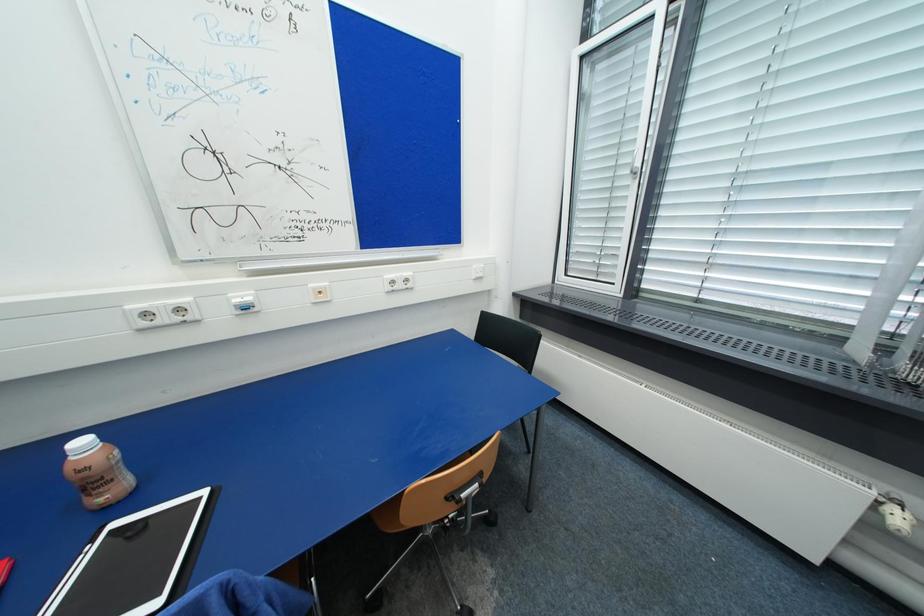
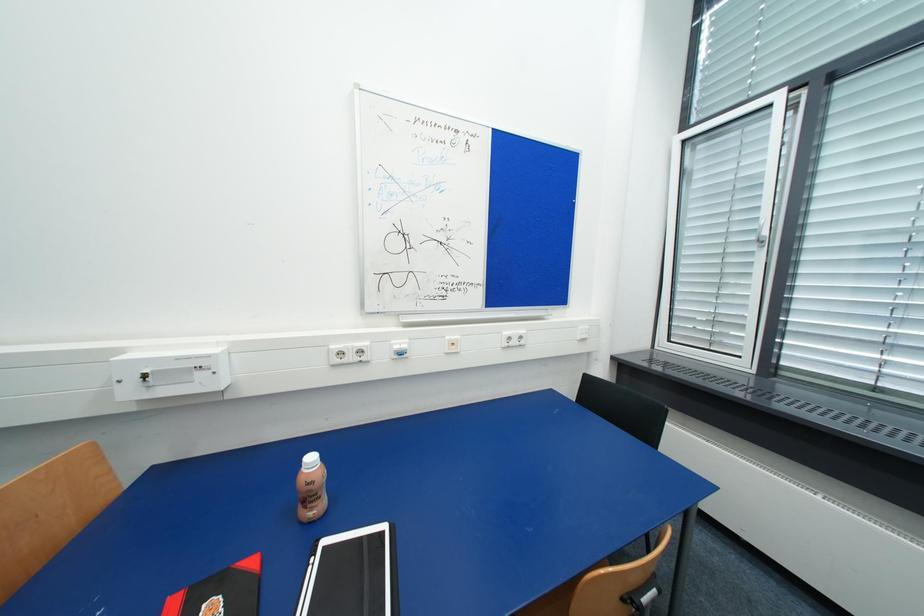
Question: How did the camera likely rotate?

Choices:
 (A) Left
 (B) Right
 (C) Up
 (D) Down

Answer: (A)